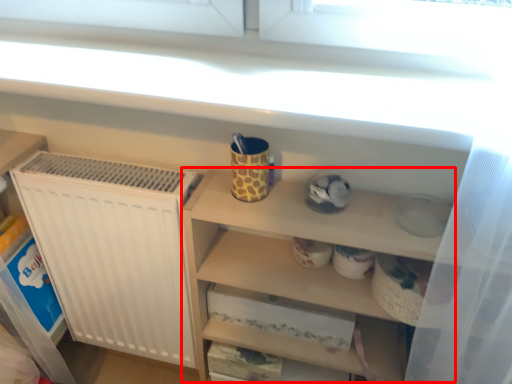
Question: From the image's perspective, where is cabinet (annotated by the red box) located in relation to mug in the image?

Choices:
 (A) above
 (B) below

Answer: (B)